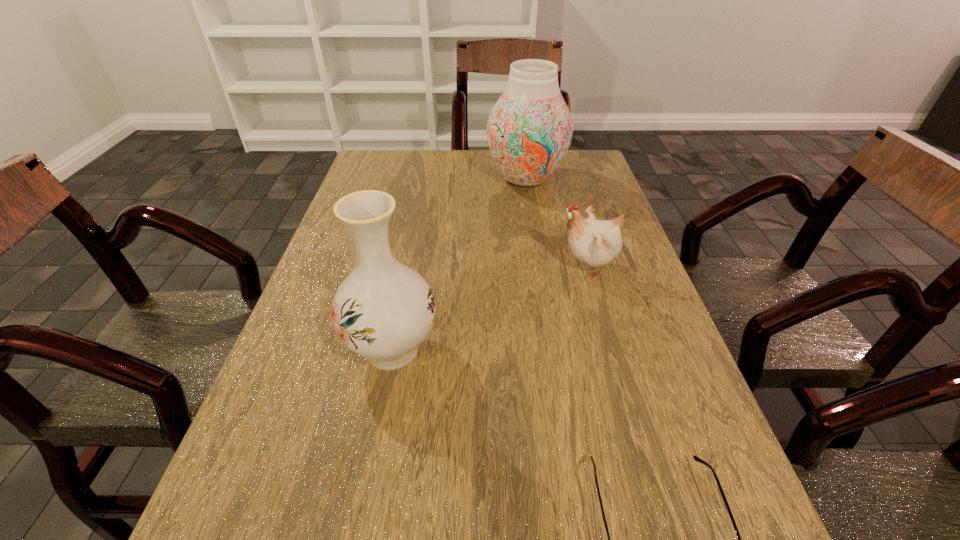
The image size is (960, 540). What are the coordinates of `the farther vase` in the screenshot? It's located at (529, 130).

At what (x,y) coordinates should I click in order to perform the action: click on the farthest object. Please return your answer as a coordinate pair (x, y). The height and width of the screenshot is (540, 960). Looking at the image, I should click on (529, 130).

At what (x,y) coordinates should I click in order to perform the action: click on the second nearest object. Please return your answer as a coordinate pair (x, y). This screenshot has width=960, height=540. Looking at the image, I should click on (383, 310).

The image size is (960, 540). I want to click on the left vase, so click(x=383, y=310).

The image size is (960, 540). Find the location of `bird`. bird is located at coordinates (595, 242).

Locate an element on the screen. This screenshot has width=960, height=540. the third nearest object is located at coordinates (595, 242).

The image size is (960, 540). Identify the location of vacant space situated on the left of the farthest object. (396, 178).

Identify the location of free location located on the front of the left vase. This screenshot has height=540, width=960. coord(370,469).

Find the location of `free location located at the beak of the second shortest object`. free location located at the beak of the second shortest object is located at coordinates (512, 267).

This screenshot has height=540, width=960. I want to click on vacant space located 0.210m at the beak of the second shortest object, so click(464, 267).